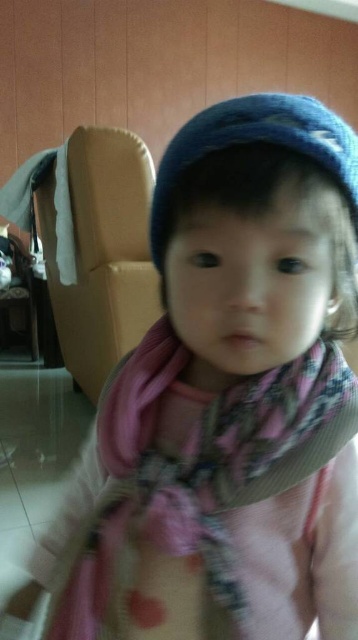
From the picture: You are a photographer standing in the room. You want to take a closeup shot of the pink plaid scarf at center. The camera you are using has a minimum focusing distance of 12 inches. Will you be able to take the photo without moving closer?

The distance of pink plaid scarf at center from viewer is 14.72 inches, which is greater than the camera minimum focusing distance of 12 inches. Therefore, you can take the photo without moving closer.

You are standing in the room and want to sit down on the beige fabric armchair at left. Where should you walk to? Please provide the coordinates in the format of point

The beige fabric armchair at left is located at point (102, 252), so you should walk to that coordinate to sit down on it.

You are a photographer setting up a shoot in this room. You want to take a photo that includes both the pink plaid scarf at center and the beige fabric armchair at left. Which object should you focus on first to ensure both are in frame?

You should focus on the pink plaid scarf at center first because it is closer to the viewer than the beige fabric armchair at left, ensuring both are in frame by adjusting the camera angle accordingly.